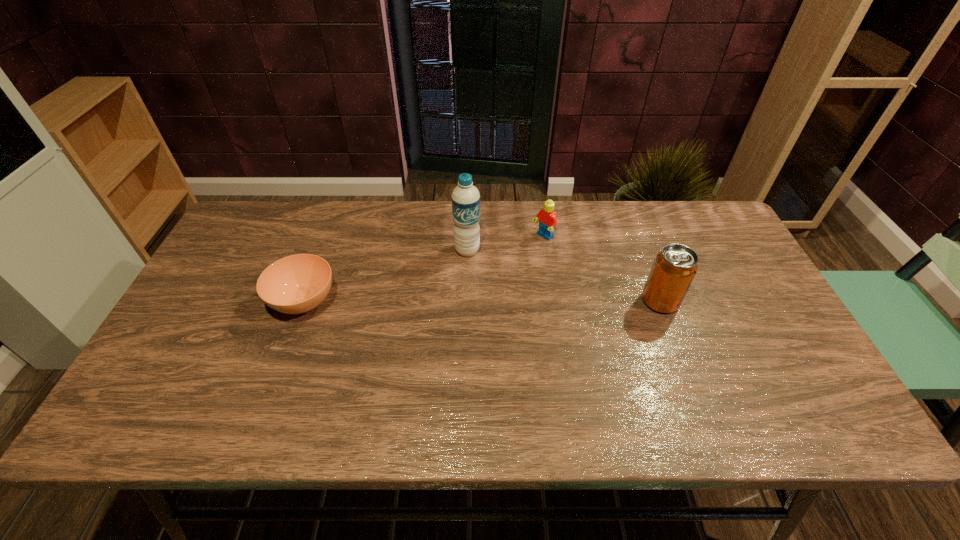
This screenshot has height=540, width=960. Find the location of `soup bowl`. soup bowl is located at coordinates click(x=296, y=284).

The image size is (960, 540). In order to click on the shortest object in this screenshot , I will do `click(296, 284)`.

Where is `soda can`? This screenshot has height=540, width=960. soda can is located at coordinates (674, 268).

This screenshot has width=960, height=540. In order to click on the rightmost object in this screenshot , I will do (x=674, y=268).

Where is `water bottle`? The width and height of the screenshot is (960, 540). water bottle is located at coordinates (465, 197).

The image size is (960, 540). I want to click on the second object from left to right, so click(465, 197).

Locate an element on the screen. This screenshot has width=960, height=540. Lego is located at coordinates (547, 218).

The width and height of the screenshot is (960, 540). I want to click on the second object from right to left, so click(547, 218).

Where is `vacant space located 0.330m on the right of the soup bowl`? vacant space located 0.330m on the right of the soup bowl is located at coordinates (460, 301).

Identify the location of free space located on the back of the third shortest object. The image size is (960, 540). (636, 238).